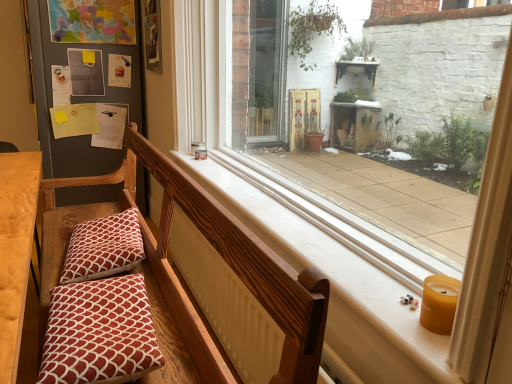
Question: Is wooden church bench at center aimed at yellow wax candle at lower right?

Choices:
 (A) yes
 (B) no

Answer: (B)

Question: Does wooden church bench at center have a greater width compared to yellow wax candle at lower right?

Choices:
 (A) no
 (B) yes

Answer: (B)

Question: Is wooden church bench at center positioned before yellow wax candle at lower right?

Choices:
 (A) no
 (B) yes

Answer: (B)

Question: From the image's perspective, is wooden church bench at center on top of yellow wax candle at lower right?

Choices:
 (A) yes
 (B) no

Answer: (B)

Question: Is wooden church bench at center not near yellow wax candle at lower right?

Choices:
 (A) no
 (B) yes

Answer: (A)

Question: From a real-world perspective, is smooth white window sill at center above or below patterned fabric pillow at lower left, which ranks as the second pillow in front-to-back order?

Choices:
 (A) above
 (B) below

Answer: (A)

Question: Is smooth white window sill at center inside the boundaries of patterned fabric pillow at lower left, which ranks as the second pillow in front-to-back order, or outside?

Choices:
 (A) outside
 (B) inside

Answer: (A)

Question: From the image's perspective, is smooth white window sill at center above or below patterned fabric pillow at lower left, which ranks as the second pillow in front-to-back order?

Choices:
 (A) below
 (B) above

Answer: (B)

Question: Is smooth white window sill at center wider or thinner than patterned fabric pillow at lower left, placed as the 1th pillow when sorted from back to front?

Choices:
 (A) thin
 (B) wide

Answer: (A)

Question: Is wooden church bench at center wider or thinner than red printed cushion at lower left, the first pillow when ordered from front to back?

Choices:
 (A) thin
 (B) wide

Answer: (B)

Question: In the image, is wooden church bench at center positioned in front of or behind red printed cushion at lower left, the first pillow when ordered from front to back?

Choices:
 (A) front
 (B) behind

Answer: (A)

Question: From the image's perspective, is wooden church bench at center positioned above or below red printed cushion at lower left, the first pillow when ordered from front to back?

Choices:
 (A) below
 (B) above

Answer: (B)

Question: From a real-world perspective, is wooden church bench at center above or below red printed cushion at lower left, the first pillow when ordered from front to back?

Choices:
 (A) above
 (B) below

Answer: (B)

Question: Considering the positions of smooth white window sill at center and yellow wax candle at lower right in the image, is smooth white window sill at center taller or shorter than yellow wax candle at lower right?

Choices:
 (A) tall
 (B) short

Answer: (A)

Question: From a real-world perspective, relative to yellow wax candle at lower right, is smooth white window sill at center vertically above or below?

Choices:
 (A) above
 (B) below

Answer: (A)